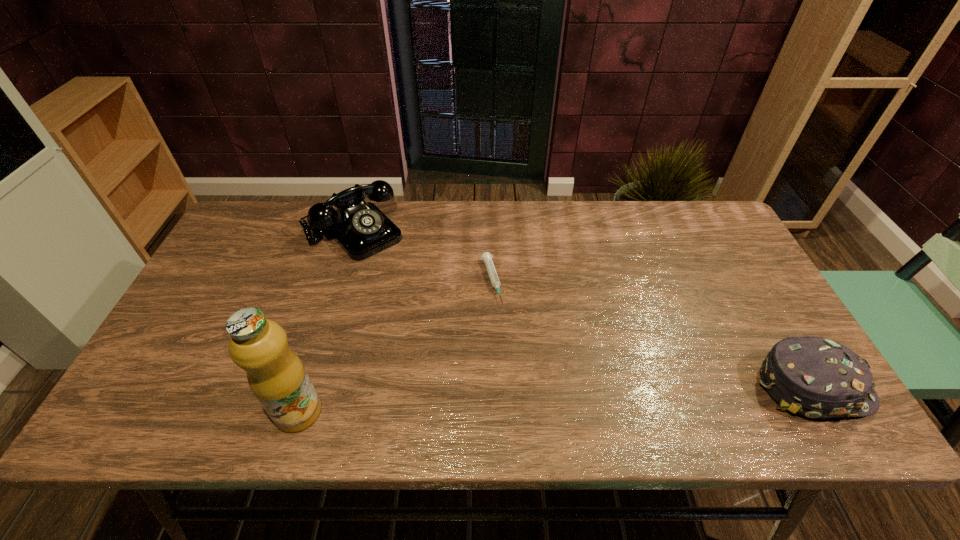
At what (x,y) coordinates should I click in order to perform the action: click on the tallest object. Please return your answer as a coordinate pair (x, y). Image resolution: width=960 pixels, height=540 pixels. Looking at the image, I should click on (276, 375).

At what (x,y) coordinates should I click in order to perform the action: click on the second shortest object. Please return your answer as a coordinate pair (x, y). Image resolution: width=960 pixels, height=540 pixels. Looking at the image, I should click on (815, 377).

In order to click on headwear in this screenshot , I will do `click(815, 377)`.

This screenshot has width=960, height=540. I want to click on syringe, so click(486, 257).

Image resolution: width=960 pixels, height=540 pixels. I want to click on the shortest object, so click(486, 257).

I want to click on the third shortest object, so click(x=361, y=229).

Where is `free spot located at the needle end of the syringe`? The image size is (960, 540). free spot located at the needle end of the syringe is located at coordinates (505, 339).

Where is `free location located at the needle end of the syringe`? This screenshot has width=960, height=540. free location located at the needle end of the syringe is located at coordinates (521, 391).

Locate an element on the screen. free space located at the needle end of the syringe is located at coordinates (498, 320).

Identify the location of free space located on the dial of the telephone. The width and height of the screenshot is (960, 540). (420, 298).